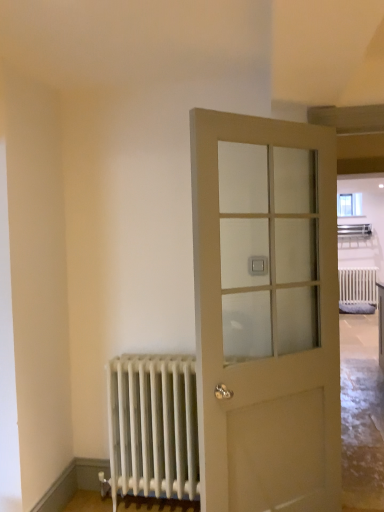
What do you see at coordinates (153, 426) in the screenshot?
I see `white metallic radiator at lower left` at bounding box center [153, 426].

At what (x,y) coordinates should I click in order to perform the action: click on white metallic radiator at lower left. Please return your answer as a coordinate pair (x, y). This screenshot has width=384, height=512. Looking at the image, I should click on (153, 426).

Image resolution: width=384 pixels, height=512 pixels. What do you see at coordinates (266, 313) in the screenshot?
I see `matte glass door at center` at bounding box center [266, 313].

You are a GUI agent. You are given a task and a screenshot of the screen. Output one action in this format:
    pyautogui.click(x=<x>, y=<y>)
    Task: Click on the matte glass door at center
    
    Given the screenshot: What is the action you would take?
    pyautogui.click(x=266, y=313)

I want to click on white metallic radiator at lower left, so 153,426.

Between matte glass door at center and white metallic radiator at lower left, which one appears on the right side from the viewer's perspective?

Positioned to the right is matte glass door at center.

Considering their positions, is matte glass door at center located in front of or behind white metallic radiator at lower left?

Visually, matte glass door at center is located in front of white metallic radiator at lower left.

Which point is more distant from viewer, (230,381) or (170,430)?

The point (170,430) is behind.

From the image's perspective, which one is positioned higher, matte glass door at center or white metallic radiator at lower left?

matte glass door at center is shown above in the image.

From a real-world perspective, is matte glass door at center on white metallic radiator at lower left?

Correct, in the physical world, matte glass door at center is higher than white metallic radiator at lower left.

Considering the relative sizes of matte glass door at center and white metallic radiator at lower left in the image provided, is matte glass door at center wider than white metallic radiator at lower left?

No, matte glass door at center is not wider than white metallic radiator at lower left.

Between matte glass door at center and white metallic radiator at lower left, which one has less height?

Standing shorter between the two is white metallic radiator at lower left.

Based on their sizes in the image, would you say matte glass door at center is bigger or smaller than white metallic radiator at lower left?

Clearly, matte glass door at center is larger in size than white metallic radiator at lower left.

Would you say matte glass door at center is outside white metallic radiator at lower left?

Yes, matte glass door at center is not within white metallic radiator at lower left.

In the scene shown: Is matte glass door at center not close to white metallic radiator at lower left?

Actually, matte glass door at center and white metallic radiator at lower left are a little close together.

Is matte glass door at center aimed at white metallic radiator at lower left?

No, matte glass door at center is not facing towards white metallic radiator at lower left.

This screenshot has width=384, height=512. Identify the location of radiator that appears on the left of matte glass door at center. (153, 426).

Considering the positions of objects white metallic radiator at lower left and matte glass door at center in the image provided, who is more to the left, white metallic radiator at lower left or matte glass door at center?

white metallic radiator at lower left.

Consider the image. Who is more distant, white metallic radiator at lower left or matte glass door at center?

white metallic radiator at lower left is further from the camera.

Does point (114, 501) come closer to viewer compared to point (304, 192)?

No, it is behind (304, 192).

Consider the image. From the image's perspective, which is below, white metallic radiator at lower left or matte glass door at center?

white metallic radiator at lower left, from the image's perspective.

From a real-world perspective, is white metallic radiator at lower left positioned above or below matte glass door at center?

white metallic radiator at lower left is below matte glass door at center.

Considering the sizes of objects white metallic radiator at lower left and matte glass door at center in the image provided, who is thinner, white metallic radiator at lower left or matte glass door at center?

With smaller width is matte glass door at center.

Between white metallic radiator at lower left and matte glass door at center, which one has more height?

With more height is matte glass door at center.

Considering the relative sizes of white metallic radiator at lower left and matte glass door at center in the image provided, is white metallic radiator at lower left smaller than matte glass door at center?

Yes.

Is matte glass door at center inside white metallic radiator at lower left?

Definitely not — matte glass door at center is not inside white metallic radiator at lower left.

Consider the image. Can you see white metallic radiator at lower left touching matte glass door at center?

They are not placed beside each other.

In the scene shown: Is white metallic radiator at lower left oriented towards matte glass door at center?

No, white metallic radiator at lower left is not oriented towards matte glass door at center.

What's the angular difference between white metallic radiator at lower left and matte glass door at center's facing directions?

The facing directions of white metallic radiator at lower left and matte glass door at center are 37.8 degrees apart.

Find the location of a particular element. The width and height of the screenshot is (384, 512). radiator behind the matte glass door at center is located at coordinates (153, 426).

Where is `door above the white metallic radiator at lower left (from a real-world perspective)`? This screenshot has height=512, width=384. door above the white metallic radiator at lower left (from a real-world perspective) is located at coordinates (266, 313).

The image size is (384, 512). I want to click on radiator below the matte glass door at center (from the image's perspective), so click(153, 426).